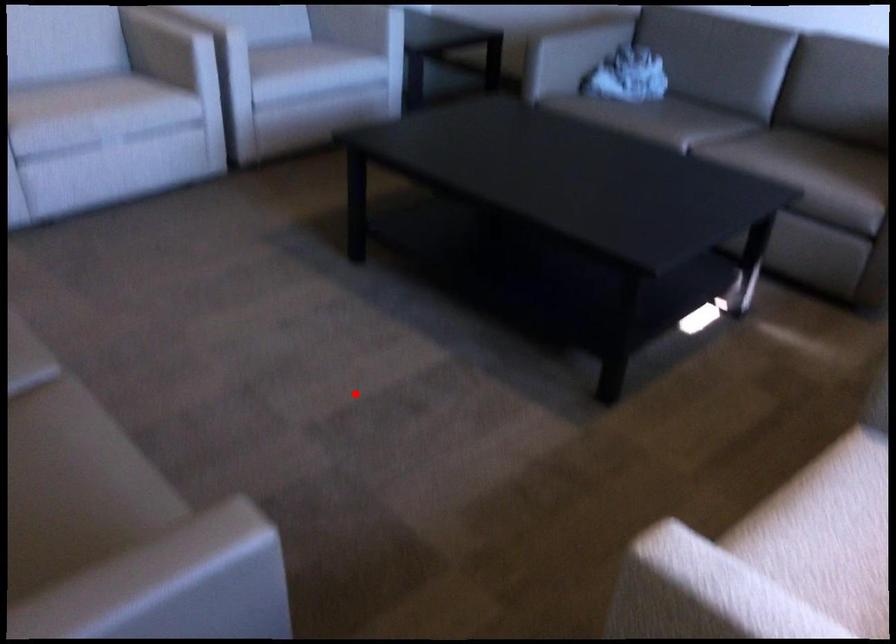
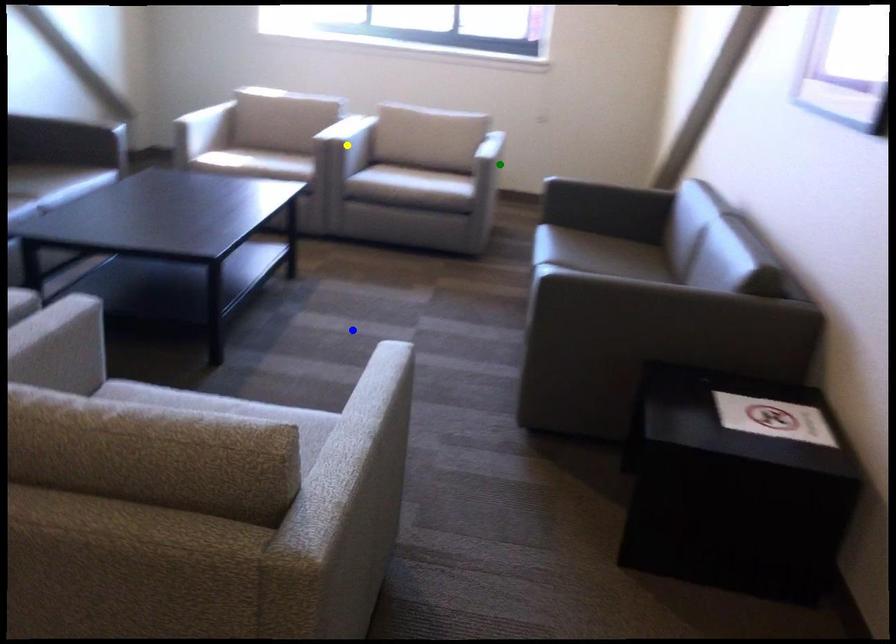
Question: I am providing you with two images of the same scene from different viewpoints. A red point is marked on the first image. You are given multiple points on the second image. In image 2, which mark is for the same physical point as the one in image 1?

Choices:
 (A) blue point
 (B) yellow point
 (C) green point

Answer: (A)